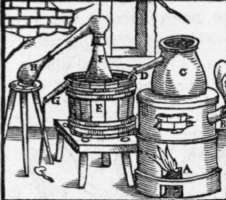
What are the coordinates of `stool legs` in the screenshot? It's located at (10, 104), (23, 113), (39, 113).